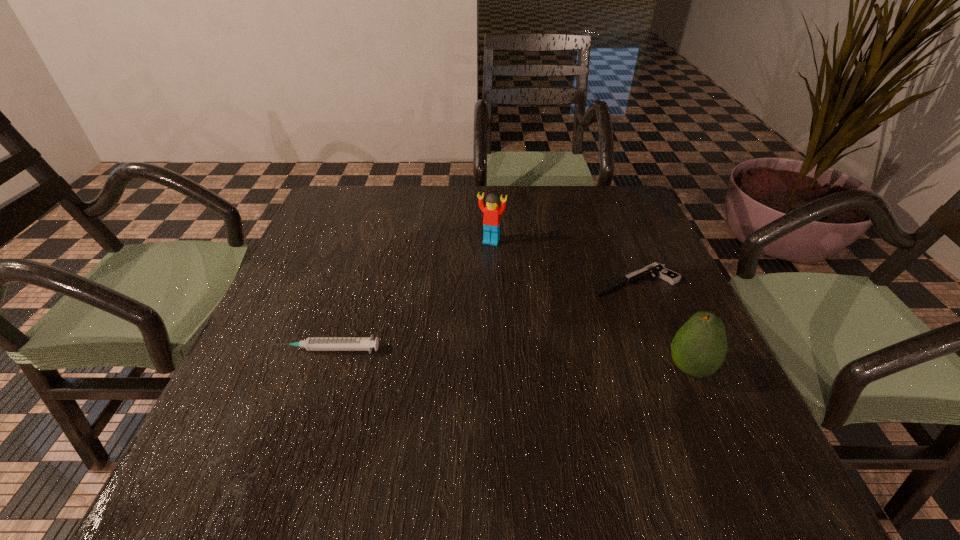
Locate an element on the screen. This screenshot has width=960, height=540. blank area located on the face of the third object from right to left is located at coordinates (452, 345).

Find the location of a particular element. blank space located 0.280m on the front-facing side of the third nearest object is located at coordinates (493, 336).

Locate an element on the screen. The image size is (960, 540). free space located on the front-facing side of the third nearest object is located at coordinates (541, 314).

I want to click on vacant space located 0.090m on the front-facing side of the third nearest object, so click(x=566, y=303).

At what (x,y) coordinates should I click in order to perform the action: click on object that is positioned at the near edge. Please return your answer as a coordinate pair (x, y). This screenshot has width=960, height=540. Looking at the image, I should click on (699, 348).

Where is `object that is at the left edge`? The height and width of the screenshot is (540, 960). object that is at the left edge is located at coordinates (311, 343).

Identify the location of avocado present at the right edge. The width and height of the screenshot is (960, 540). [699, 348].

At what (x,y) coordinates should I click in order to perform the action: click on pistol situated at the right edge. Please return your answer as a coordinate pair (x, y). Looking at the image, I should click on (657, 270).

Where is `object that is at the near right corner`? Image resolution: width=960 pixels, height=540 pixels. object that is at the near right corner is located at coordinates (699, 348).

The height and width of the screenshot is (540, 960). In the image, there is a desktop. Find the location of `vacant space at the far edge`. vacant space at the far edge is located at coordinates (424, 204).